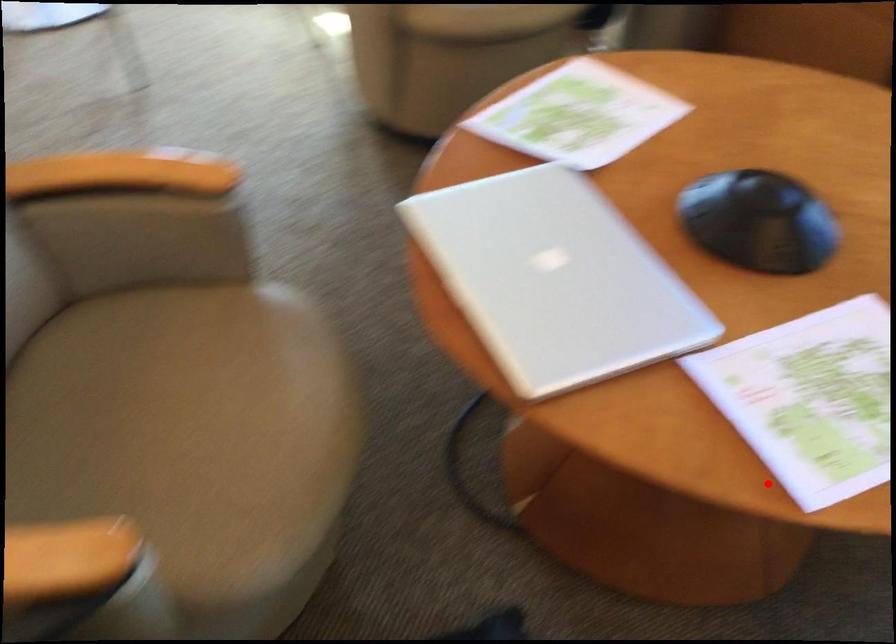
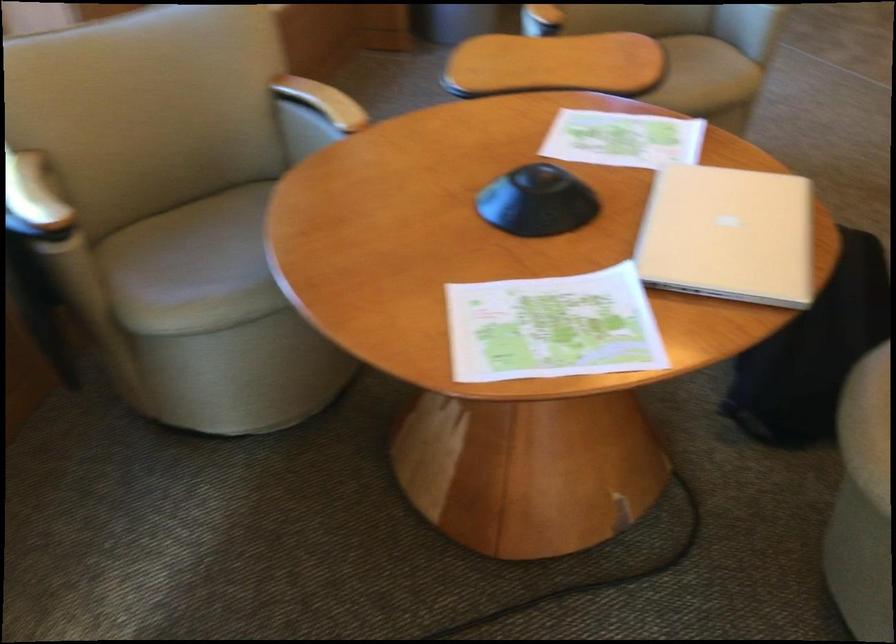
Question: I am providing you with two images of the same scene from different viewpoints. In image1, a red point is highlighted. Considering the same 3D point in image2, which of the following is correct?

Choices:
 (A) It is closer
 (B) It is farther

Answer: (B)